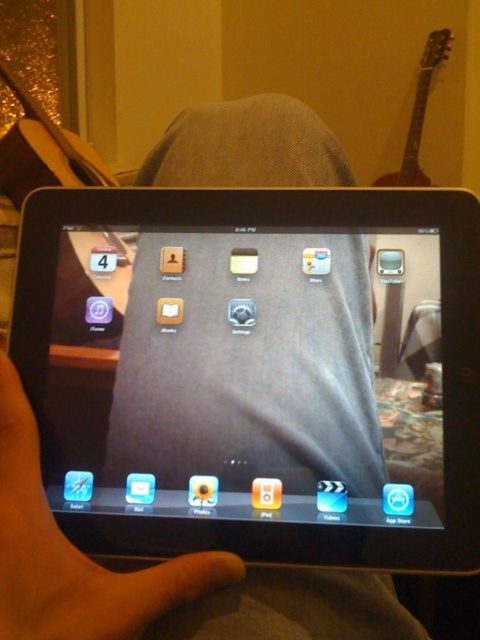
You are trying to determine if the black glossy tablet at center can fit into a protective case designed for devices smaller than the matte skin hand at center. Can it fit?

The black glossy tablet at center has a larger size compared to the matte skin hand at center, so it cannot fit into a protective case designed for devices smaller than the matte skin hand at center.

You are a photographer trying to focus on the two points in the image, namely point (107, 243) and point (72, 602). Which point should you adjust your focus to first if you want to capture both clearly in the same photo?

You should focus on point (107, 243) first because it is closer to the camera than point (72, 602). This way, adjusting focus from near to far will help ensure both points are in focus when using depth of field.

You are trying to determine if the black glossy tablet at center can fit into a protective case designed for devices with a maximum width of 15 cm. Given that the matte skin hand at center is 10 cm wide, can the tablet fit into the case?

The black glossy tablet at center is wider than the matte skin hand at center, which is 10 cm. Since the tablet is wider than 10 cm but the case allows up to 15 cm, the tablet can fit into the case as long as its width is under 15 cm. However, without the exact width of the tablet, we can only confirm it is wider than 10 cm.